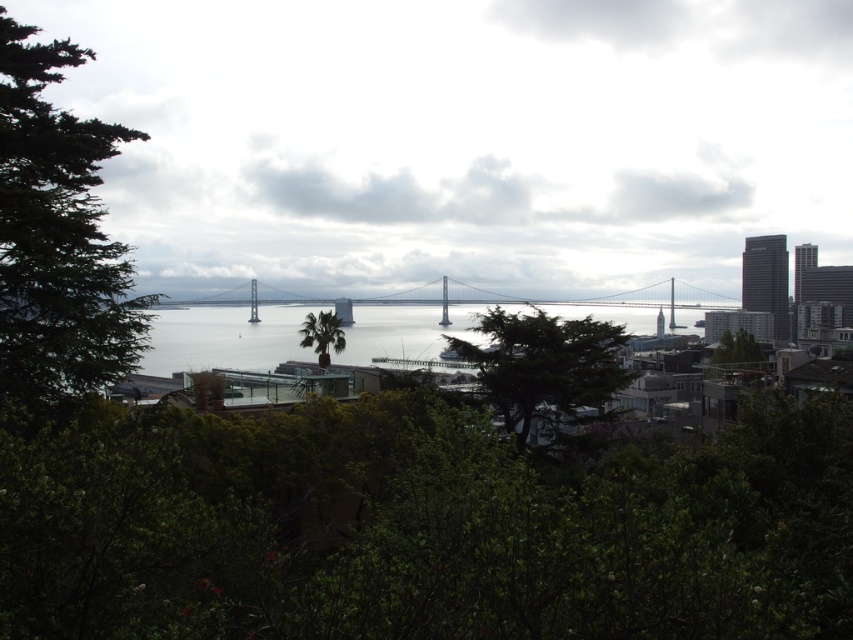
Question: Which point appears farthest from the camera in this image?

Choices:
 (A) (45, 109)
 (B) (299, 330)

Answer: (B)

Question: Can you confirm if green leafy tree at left is bigger than green leafy palm tree at center?

Choices:
 (A) yes
 (B) no

Answer: (A)

Question: Which object is positioned farthest from the green leafy tree at center?

Choices:
 (A) green leafy tree at center-right
 (B) transparent glass bridge at center

Answer: (A)

Question: Which of these objects is positioned farthest from the clear water at center?

Choices:
 (A) transparent glass bridge at center
 (B) green leafy tree at center
 (C) green leafy tree at left

Answer: (C)

Question: Does transparent glass bridge at center have a larger size compared to clear water at center?

Choices:
 (A) no
 (B) yes

Answer: (B)

Question: Can you confirm if green leafy tree at left is positioned to the left of clear water at center?

Choices:
 (A) yes
 (B) no

Answer: (A)